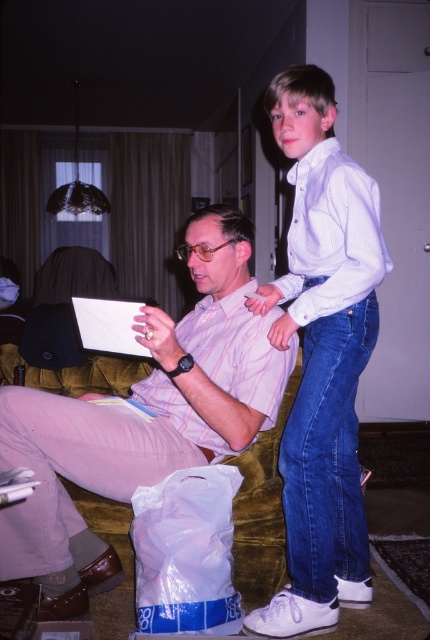
You are a photographer standing in the living room. You want to take a photo of the white denim jeans at upper right and the pink striped shirt at center. How far apart are these two items in the image?

The white denim jeans at upper right is 8.66 inches away from the pink striped shirt at center.